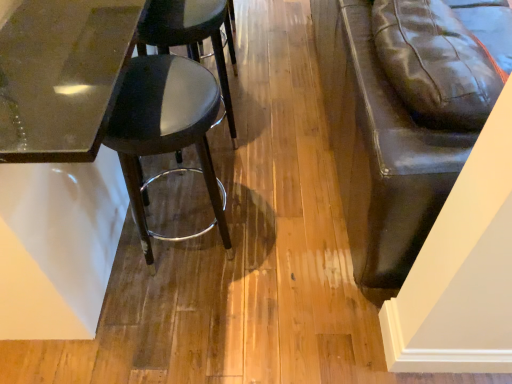
Locate an element on the screen. This screenshot has width=512, height=384. free space in front of black leather stool at center, positioned as the 1th stool in top-to-bottom order is located at coordinates (208, 196).